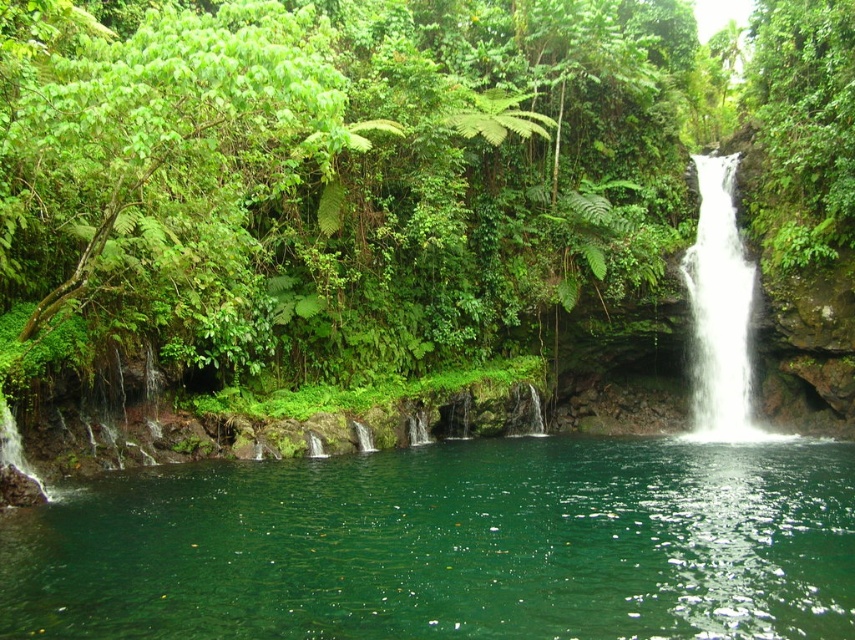
Question: Based on their relative distances, which object is nearer to the white smooth waterfall at right?

Choices:
 (A) green leafy foliage at upper center
 (B) green translucent water at center

Answer: (A)

Question: Which object appears closest to the camera in this image?

Choices:
 (A) green translucent water at center
 (B) green leafy foliage at upper center

Answer: (A)

Question: Among these objects, which one is farthest from the camera?

Choices:
 (A) green translucent water at center
 (B) green leafy foliage at upper center
 (C) white smooth waterfall at right

Answer: (C)

Question: Where is green leafy foliage at upper center located in relation to green translucent water at center in the image?

Choices:
 (A) above
 (B) below

Answer: (A)

Question: Can you confirm if green leafy foliage at upper center is smaller than green translucent water at center?

Choices:
 (A) no
 (B) yes

Answer: (A)

Question: Does green leafy foliage at upper center appear on the left side of white smooth waterfall at right?

Choices:
 (A) no
 (B) yes

Answer: (B)